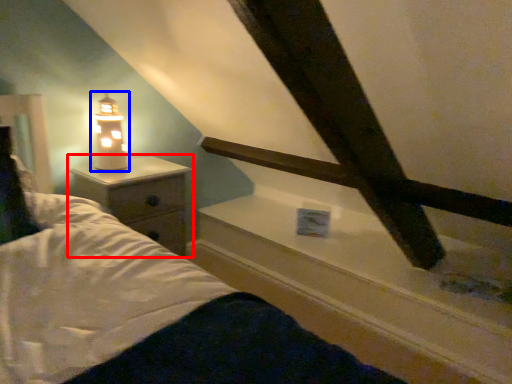
Question: Which point is further to the camera, nightstand (highlighted by a red box) or lamp (highlighted by a blue box)?

Choices:
 (A) nightstand
 (B) lamp

Answer: (B)